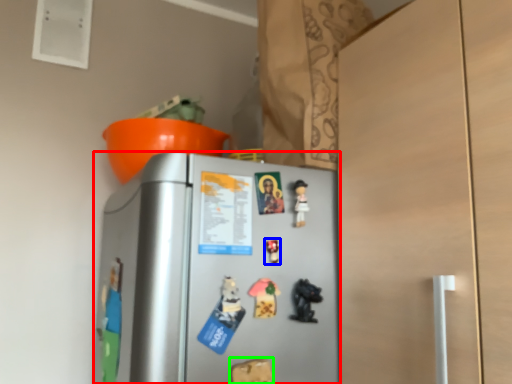
Question: Which object is the closest to the refrigerator (highlighted by a red box)? Choose among these: toy (highlighted by a blue box) or toy (highlighted by a green box).

Choices:
 (A) toy
 (B) toy

Answer: (A)